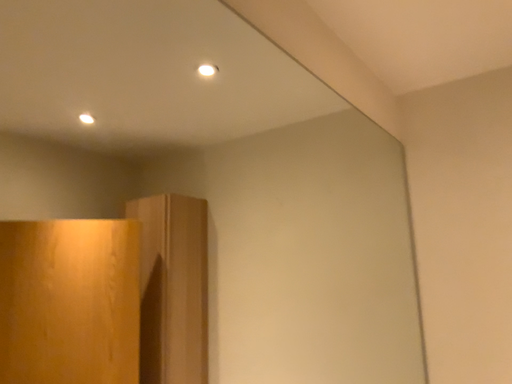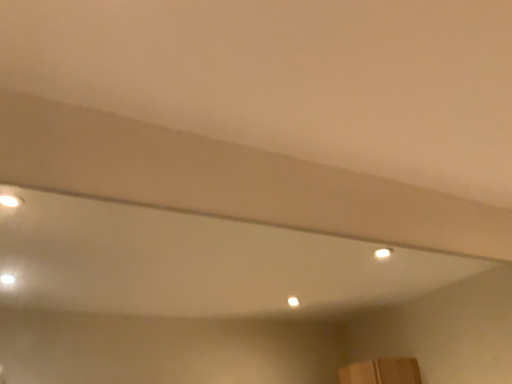
Question: Which way did the camera rotate in the video?

Choices:
 (A) rotated right
 (B) rotated left

Answer: (B)